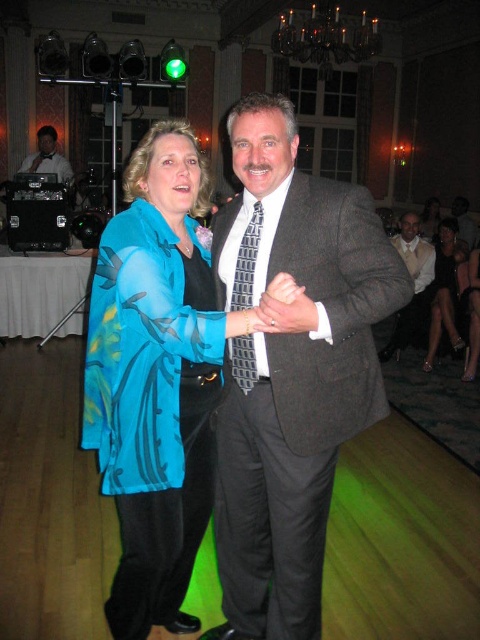
Question: Estimate the real-world distances between objects in this image. Which object is closer to the shiny silver dress at lower right?

Choices:
 (A) matte gray suit at center
 (B) blue silk blouse at center
 (C) dark gray textured suit at center
 (D) matte black dj booth at upper left

Answer: (A)

Question: Is dark gray textured suit at center wider than matte black dj booth at upper left?

Choices:
 (A) yes
 (B) no

Answer: (B)

Question: Which object is the closest to the matte black dj booth at upper left?

Choices:
 (A) blue silk blouse at center
 (B) matte gray suit at center

Answer: (B)

Question: Can you confirm if blue silk blouse at center is wider than matte black dj booth at upper left?

Choices:
 (A) no
 (B) yes

Answer: (A)

Question: Does blue silk blouse at center have a greater width compared to white satin vest at right?

Choices:
 (A) yes
 (B) no

Answer: (A)

Question: Which object is positioned farthest from the matte black dj booth at upper left?

Choices:
 (A) blue silk blouse at center
 (B) dark gray textured suit at center
 (C) shiny silver dress at lower right
 (D) white satin vest at right

Answer: (B)